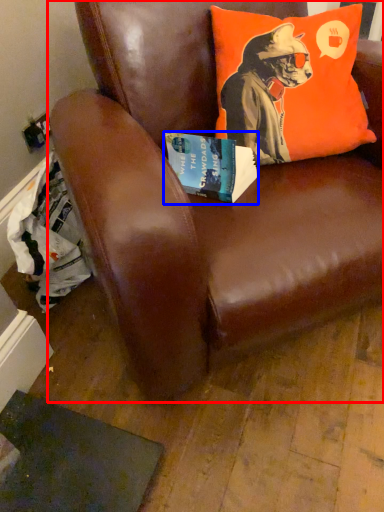
Question: Among these objects, which one is nearest to the camera, chair (highlighted by a red box) or book (highlighted by a blue box)?

Choices:
 (A) chair
 (B) book

Answer: (A)